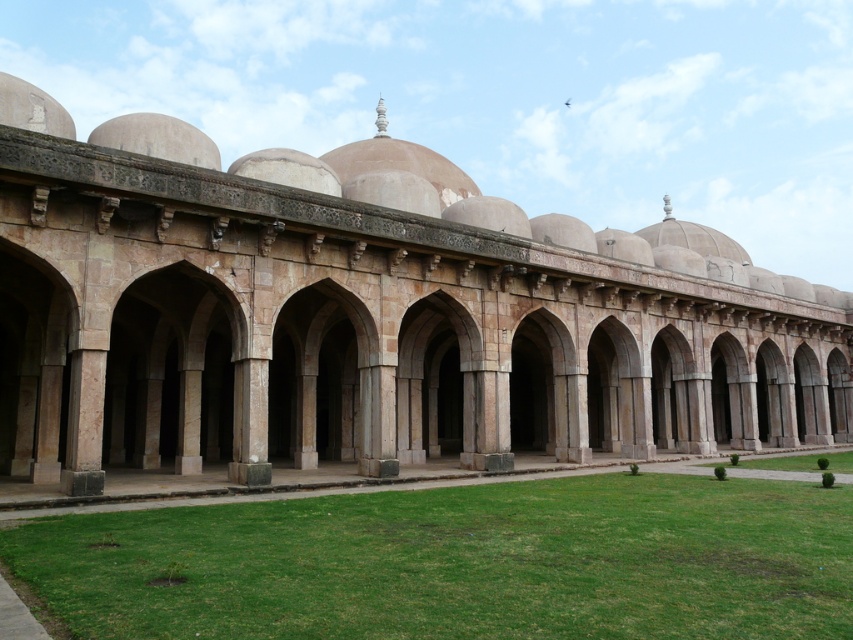
Between beige stone arches at center and green grass at lower center, which one has more height?

With more height is beige stone arches at center.

Can you confirm if beige stone arches at center is wider than green grass at lower center?

Yes.

The width and height of the screenshot is (853, 640). What do you see at coordinates (367, 314) in the screenshot?
I see `beige stone arches at center` at bounding box center [367, 314].

The image size is (853, 640). In order to click on beige stone arches at center in this screenshot , I will do `click(367, 314)`.